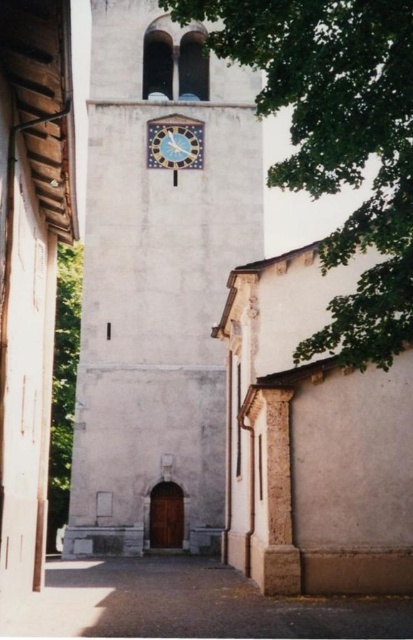
Question: Does white stone clock tower at center have a lesser width compared to green leafy tree at left?

Choices:
 (A) yes
 (B) no

Answer: (B)

Question: Which point is closer to the camera?

Choices:
 (A) blue mosaic clock at center
 (B) green leafy tree at upper center
 (C) white stone clock tower at center
 (D) brown concrete alley at lower center

Answer: (D)

Question: Which point is farther to the camera?

Choices:
 (A) brown concrete alley at lower center
 (B) green leafy tree at left

Answer: (B)

Question: Among these objects, which one is nearest to the camera?

Choices:
 (A) blue mosaic clock at center
 (B) white stone clock tower at center
 (C) green leafy tree at left

Answer: (C)

Question: Is green leafy tree at upper center wider than green leafy tree at left?

Choices:
 (A) no
 (B) yes

Answer: (B)

Question: Does white stone clock tower at center have a larger size compared to green leafy tree at left?

Choices:
 (A) yes
 (B) no

Answer: (A)